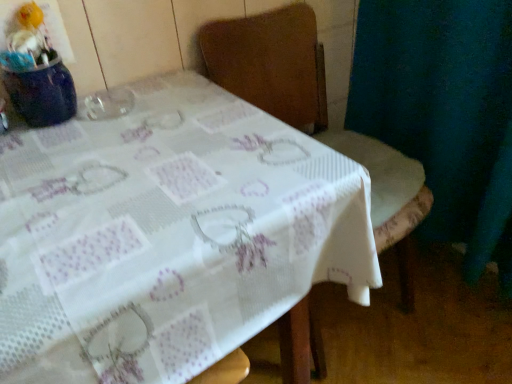
Question: Is white printed fabric at center facing away from wooden chair at center?

Choices:
 (A) yes
 (B) no

Answer: (B)

Question: Is white printed fabric at center outside of wooden chair at center?

Choices:
 (A) no
 (B) yes

Answer: (B)

Question: Is white printed fabric at center positioned behind wooden chair at center?

Choices:
 (A) yes
 (B) no

Answer: (B)

Question: Can you confirm if white printed fabric at center is thinner than wooden chair at center?

Choices:
 (A) no
 (B) yes

Answer: (A)

Question: Considering the relative sizes of white printed fabric at center and wooden chair at center in the image provided, is white printed fabric at center shorter than wooden chair at center?

Choices:
 (A) no
 (B) yes

Answer: (B)

Question: Would you say white printed fabric at center is a long distance from wooden chair at center?

Choices:
 (A) no
 (B) yes

Answer: (A)

Question: Considering the relative sizes of wooden chair at center and white printed fabric at center in the image provided, is wooden chair at center thinner than white printed fabric at center?

Choices:
 (A) no
 (B) yes

Answer: (B)

Question: Considering the relative positions of wooden chair at center and white printed fabric at center in the image provided, is wooden chair at center to the left of white printed fabric at center from the viewer's perspective?

Choices:
 (A) yes
 (B) no

Answer: (B)

Question: From the image's perspective, is wooden chair at center located above white printed fabric at center?

Choices:
 (A) no
 (B) yes

Answer: (B)

Question: Is wooden chair at center closer to camera compared to white printed fabric at center?

Choices:
 (A) no
 (B) yes

Answer: (A)

Question: Can you confirm if wooden chair at center is positioned to the right of white printed fabric at center?

Choices:
 (A) yes
 (B) no

Answer: (A)

Question: Is the surface of wooden chair at center in direct contact with white printed fabric at center?

Choices:
 (A) no
 (B) yes

Answer: (A)

Question: Choose the correct answer: Is wooden chair at center inside white printed fabric at center or outside it?

Choices:
 (A) outside
 (B) inside

Answer: (A)